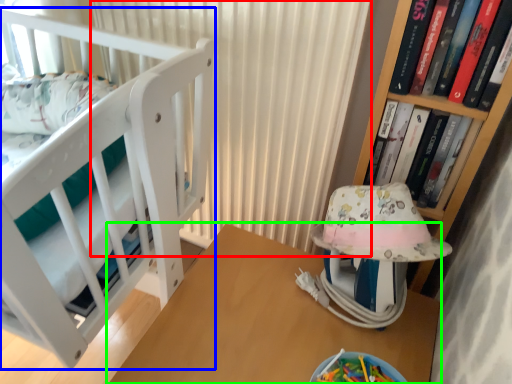
Question: Estimate the real-world distances between objects in this image. Which object is farther from curtain (highlighted by a red box), furniture (highlighted by a blue box) or table (highlighted by a green box)?

Choices:
 (A) furniture
 (B) table

Answer: (B)